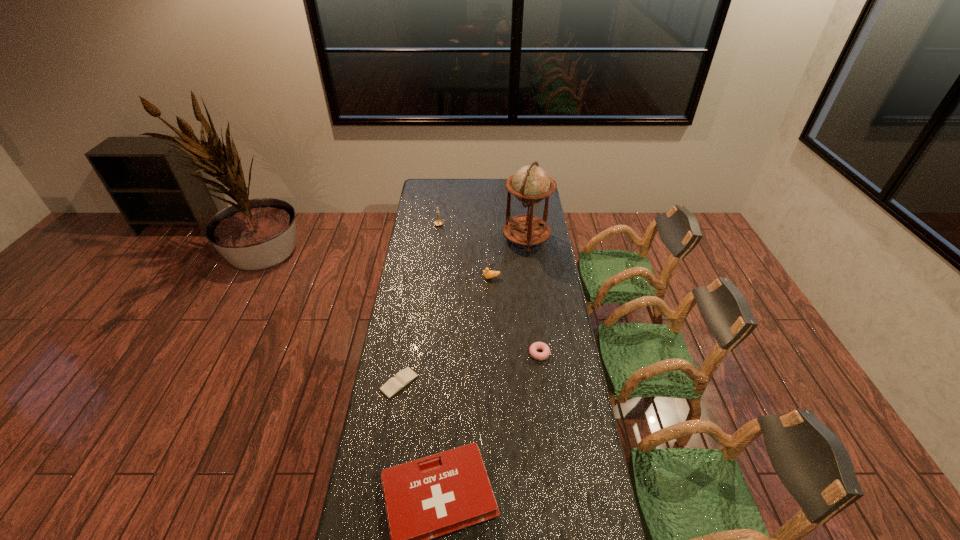
Locate an element on the screen. The image size is (960, 540). free space located on the handle side of the second tallest object is located at coordinates (490, 224).

At what (x,y) coordinates should I click in order to perform the action: click on free space located on the face of the duckling. Please return your answer as a coordinate pair (x, y). Looking at the image, I should click on (442, 278).

Where is `vacant space situated 0.280m on the face of the duckling`? The width and height of the screenshot is (960, 540). vacant space situated 0.280m on the face of the duckling is located at coordinates (425, 278).

The width and height of the screenshot is (960, 540). I want to click on vacant space located 0.100m on the face of the duckling, so click(463, 278).

Locate an element on the screen. vacant area situated 0.180m on the back of the second shortest object is located at coordinates (535, 314).

I want to click on vacant space located 0.190m on the front of the fifth farthest object, so click(389, 448).

I want to click on candle holder present at the left edge, so click(438, 222).

The height and width of the screenshot is (540, 960). I want to click on diary positioned at the left edge, so 395,384.

You are a GUI agent. You are given a task and a screenshot of the screen. Output one action in this format:
    pyautogui.click(x=<x>, y=<y>)
    Task: Click on the globe present at the right edge
    
    Given the screenshot: What is the action you would take?
    pyautogui.click(x=530, y=184)

Where is `doughnut located in the right edge section of the desktop`? The height and width of the screenshot is (540, 960). doughnut located in the right edge section of the desktop is located at coordinates (544, 347).